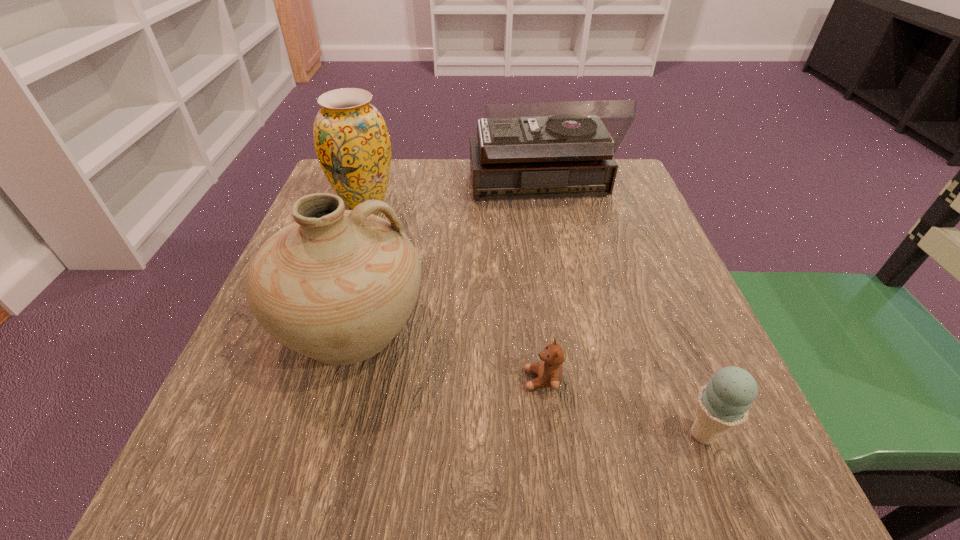
Identify the location of vacant position located 0.180m on the front-facing side of the teddy bear. (406, 380).

I want to click on vacant region located on the front-facing side of the teddy bear, so click(x=478, y=380).

This screenshot has height=540, width=960. I want to click on free region located 0.050m on the front-facing side of the teddy bear, so click(492, 380).

Find the location of a particular element. record player at the far edge is located at coordinates (531, 149).

I want to click on vase that is at the far edge, so click(x=351, y=140).

The image size is (960, 540). Find the location of `object at the near edge`. object at the near edge is located at coordinates (724, 403).

Identify the location of pottery that is at the left edge. coord(336,285).

This screenshot has width=960, height=540. What are the coordinates of `vase at the left edge` in the screenshot? It's located at (351, 140).

At what (x,y) coordinates should I click in order to perform the action: click on record player at the right edge. Please return your answer as a coordinate pair (x, y). The height and width of the screenshot is (540, 960). Looking at the image, I should click on (531, 149).

Where is `ice cream that is at the right edge`? This screenshot has width=960, height=540. ice cream that is at the right edge is located at coordinates (724, 403).